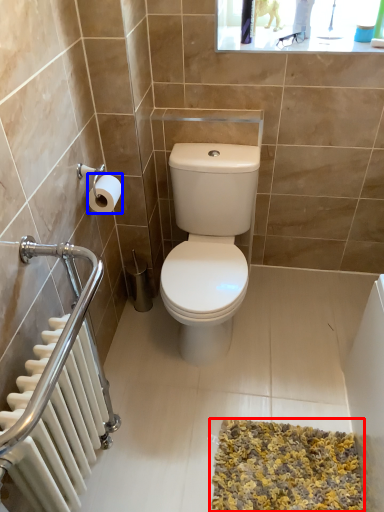
Question: Which object appears closest to the camera in this image, bath mat (highlighted by a red box) or toilet paper (highlighted by a blue box)?

Choices:
 (A) bath mat
 (B) toilet paper

Answer: (A)